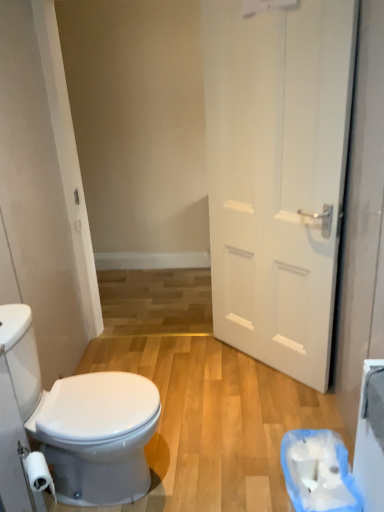
The height and width of the screenshot is (512, 384). Find the location of `space that is in front of white matte door at right`. space that is in front of white matte door at right is located at coordinates (243, 420).